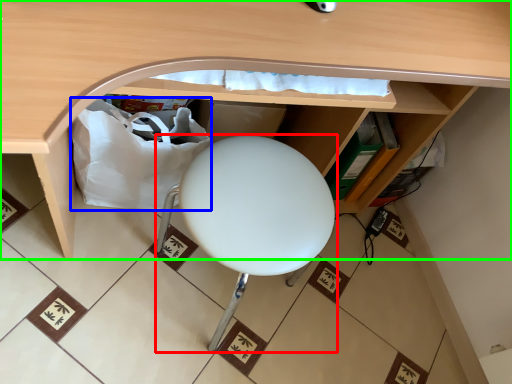
Question: Which is nearer to the furniture (highlighted by a red box)? paper bag (highlighted by a blue box) or desk (highlighted by a green box).

Choices:
 (A) paper bag
 (B) desk

Answer: (A)